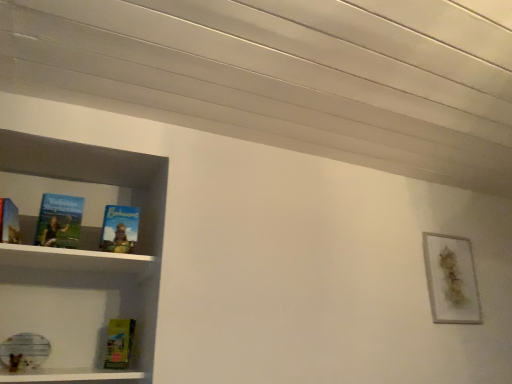
Question: Can you confirm if yellow matte paperback book at lower left is taller than matte blue book at left, which is the 1th book in left-to-right order?

Choices:
 (A) no
 (B) yes

Answer: (A)

Question: Is yellow matte paperback book at lower left oriented away from matte blue book at left, positioned as the 2th book in right-to-left order?

Choices:
 (A) no
 (B) yes

Answer: (A)

Question: Does yellow matte paperback book at lower left appear on the right side of matte blue book at left, positioned as the 2th book in right-to-left order?

Choices:
 (A) yes
 (B) no

Answer: (A)

Question: From a real-world perspective, is yellow matte paperback book at lower left positioned over matte blue book at left, which is the 1th book in left-to-right order, based on gravity?

Choices:
 (A) no
 (B) yes

Answer: (A)

Question: From the image's perspective, does yellow matte paperback book at lower left appear higher than matte blue book at left, which is the 1th book in left-to-right order?

Choices:
 (A) yes
 (B) no

Answer: (B)

Question: Is yellow matte paperback book at lower left not near matte blue book at left, which is the 1th book in left-to-right order?

Choices:
 (A) yes
 (B) no

Answer: (B)

Question: Is the depth of matte blue book at left, which is the 1th book in left-to-right order, less than that of gold textured frame at upper right?

Choices:
 (A) yes
 (B) no

Answer: (A)

Question: From the image's perspective, is matte blue book at left, which is the 1th book in left-to-right order, below gold textured frame at upper right?

Choices:
 (A) no
 (B) yes

Answer: (A)

Question: From the image's perspective, would you say matte blue book at left, which is the 1th book in left-to-right order, is positioned over gold textured frame at upper right?

Choices:
 (A) yes
 (B) no

Answer: (A)

Question: Can you confirm if matte blue book at left, which is the 1th book in left-to-right order, is bigger than gold textured frame at upper right?

Choices:
 (A) no
 (B) yes

Answer: (A)

Question: Is matte blue book at left, which is the 1th book in left-to-right order, with gold textured frame at upper right?

Choices:
 (A) yes
 (B) no

Answer: (B)

Question: Is matte blue book at left, which is the 1th book in left-to-right order, at the left side of gold textured frame at upper right?

Choices:
 (A) yes
 (B) no

Answer: (A)

Question: Is blue matte book at center, the first book viewed from the right, closer to the viewer compared to yellow matte paperback book at lower left?

Choices:
 (A) no
 (B) yes

Answer: (B)